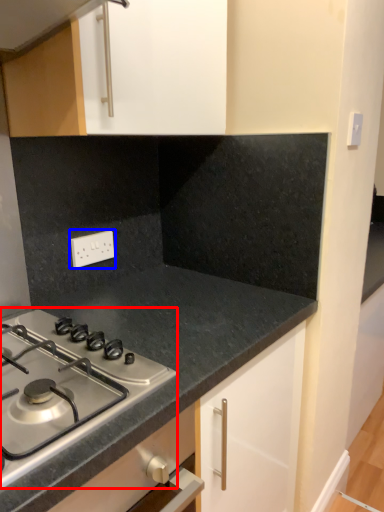
Question: Which object appears farthest to the camera in this image, gas stove (highlighted by a red box) or electric outlet (highlighted by a blue box)?

Choices:
 (A) gas stove
 (B) electric outlet

Answer: (B)